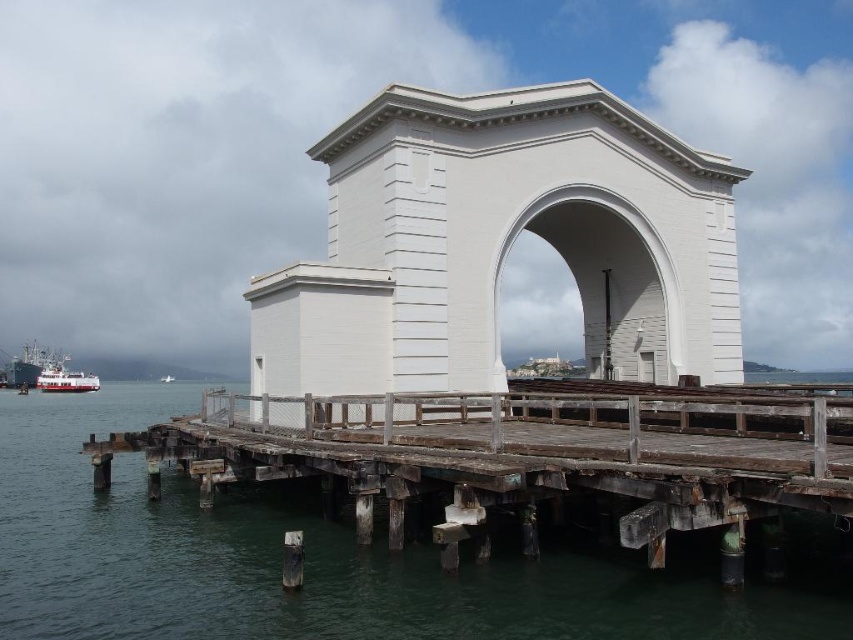
Question: Which of the following is the farthest from the observer?

Choices:
 (A) white glossy boat at lower left
 (B) white matte archway at center

Answer: (A)

Question: Considering the relative positions of transparent water at lower left and white glossy boat at lower left in the image provided, where is transparent water at lower left located with respect to white glossy boat at lower left?

Choices:
 (A) left
 (B) right

Answer: (B)

Question: Which of the following is the farthest from the observer?

Choices:
 (A) (642, 376)
 (B) (218, 611)

Answer: (A)

Question: Is the position of transparent water at lower left less distant than that of white matte archway at center?

Choices:
 (A) yes
 (B) no

Answer: (A)

Question: Where is white matte archway at center located in relation to white glossy boat at lower left in the image?

Choices:
 (A) right
 (B) left

Answer: (A)

Question: Based on their relative distances, which object is farther from the white matte archway at center?

Choices:
 (A) transparent water at lower left
 (B) white glossy boat at lower left

Answer: (B)